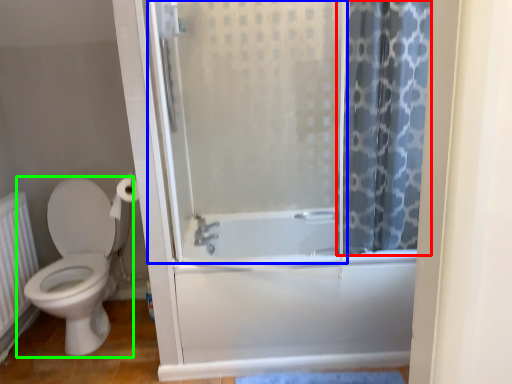
Question: Which object is positioned closest to shower curtain (highlighted by a red box)? Select from screen door (highlighted by a blue box) and toilet (highlighted by a green box).

Choices:
 (A) screen door
 (B) toilet

Answer: (A)